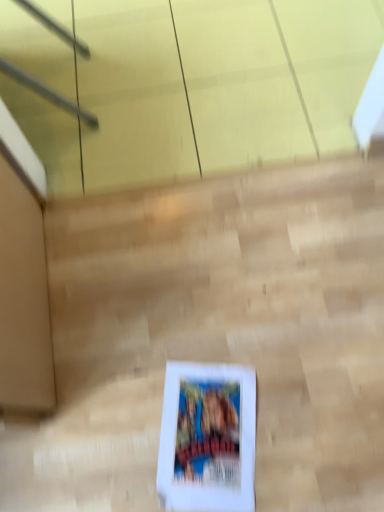
At what (x,y) coordinates should I click in order to perform the action: click on vacant space to the left of white paper at center. Please return your answer as a coordinate pair (x, y). Looking at the image, I should click on (116, 431).